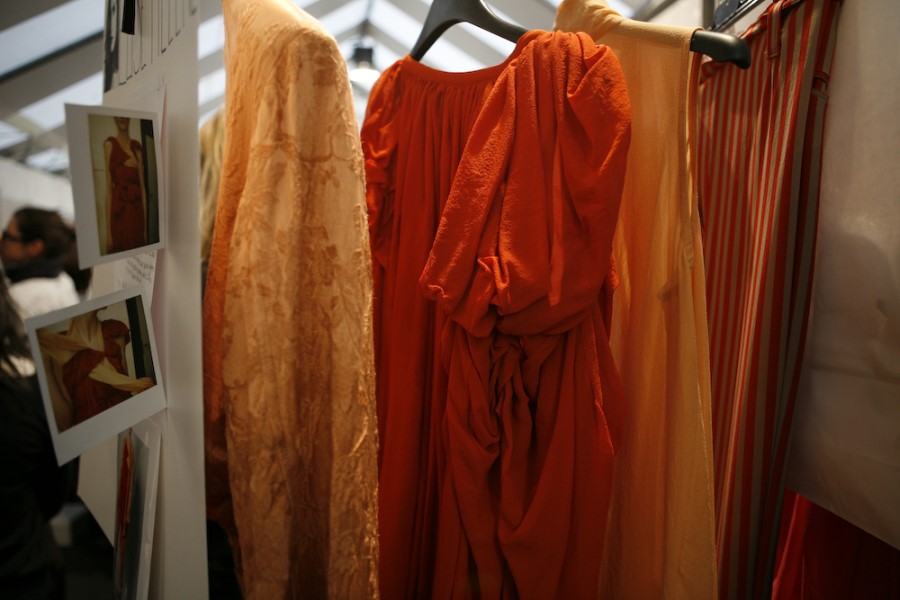
Where is `wall`? This screenshot has width=900, height=600. wall is located at coordinates (852, 153).